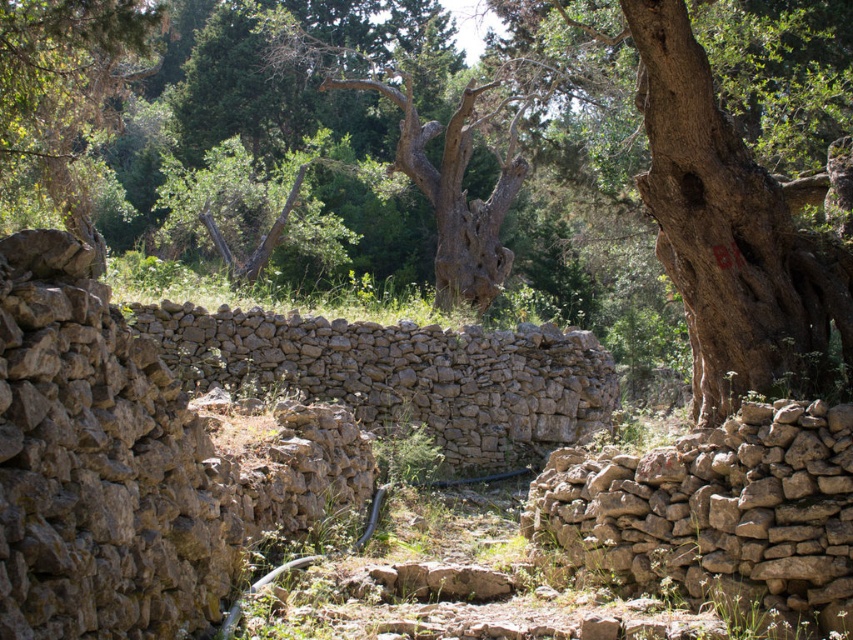
Which is in front, point (306, 280) or point (845, 480)?

Point (845, 480) is in front.

This screenshot has height=640, width=853. I want to click on smooth brown tree trunk at center, so click(x=468, y=156).

Locate an element on the screen. Image resolution: width=853 pixels, height=640 pixels. smooth brown tree trunk at center is located at coordinates (468, 156).

The height and width of the screenshot is (640, 853). In order to click on smooth brown tree trunk at center in this screenshot , I will do `click(468, 156)`.